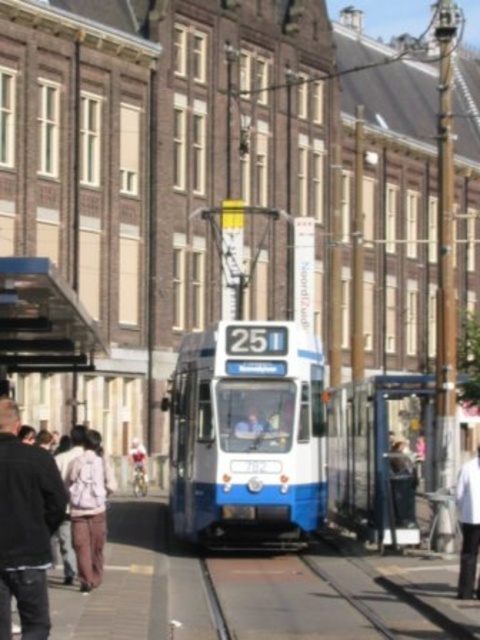
In the scene shown: You are standing on the sidewalk and looking at the scene. Which object is nearer to you between the brown metal train track at center and the light pink fabric pants at lower left?

The brown metal train track at center is closer to the viewer than the light pink fabric pants at lower left according to the description.

You are a pedestrian standing on the sidewalk next to the brown metal train track at center and the light pink fabric pants at lower left. You want to cross the street safely. Which path should you choose to avoid the wider obstacle?

You should avoid the brown metal train track at center because its width is larger than the light pink fabric pants at lower left, making it the wider obstacle to cross.

From the picture: You are a pedestrian standing on the sidewalk in the street scene. You notice the brown metal train track at center and the white cotton shirt at center. Which object is positioned lower from the ground?

The brown metal train track at center is below the white cotton shirt at center, so the brown metal train track at center is positioned lower from the ground.